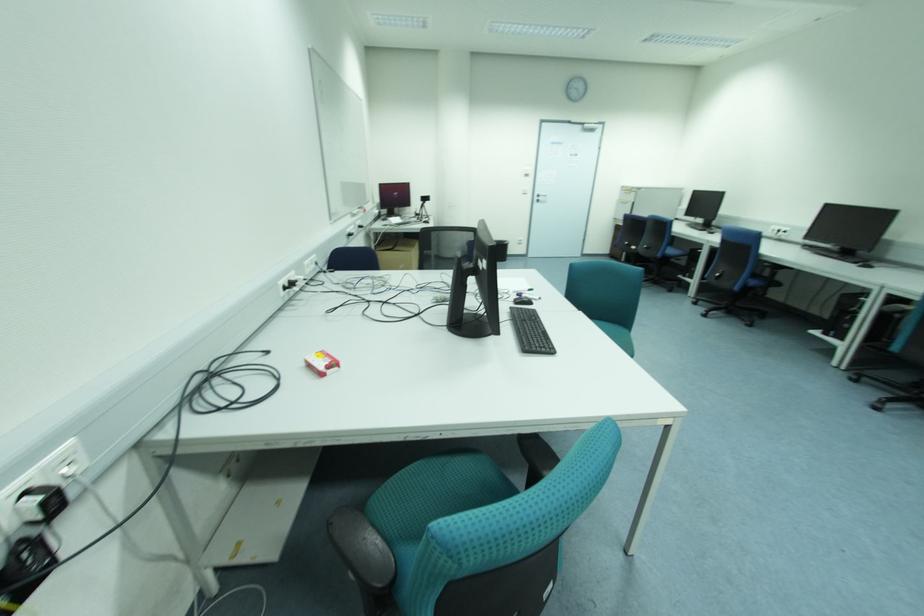
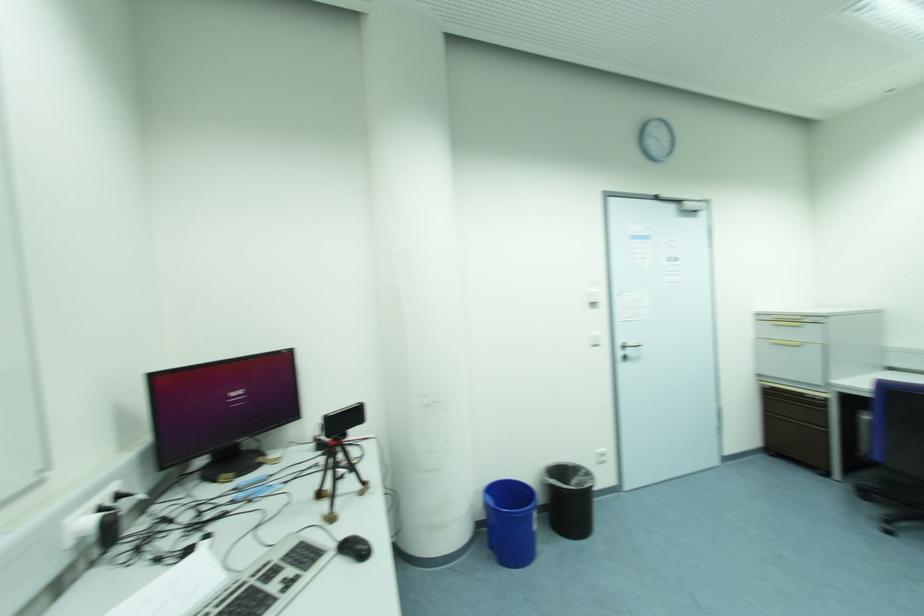
Question: Which direction would the cameraman need to move to produce the second image? Reply with the corresponding letter.

Choices:
 (A) Left
 (B) Right
 (C) Forward
 (D) Backward

Answer: (C)